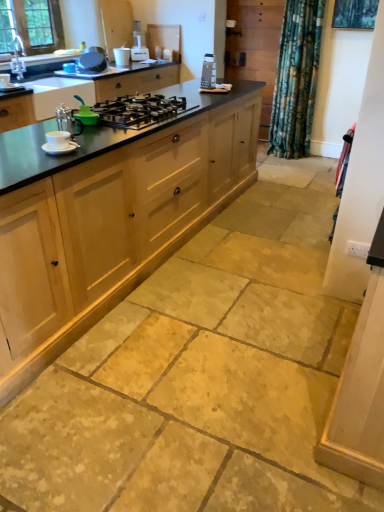
Locate an element on the screen. The height and width of the screenshot is (512, 384). free space in front of natural wood cabinetry at center is located at coordinates (170, 362).